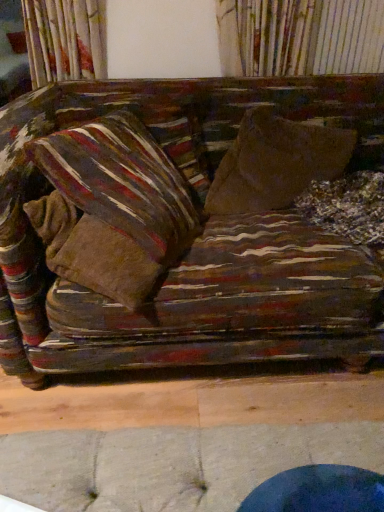
Question: Is striped fabric pillow at upper left, arranged as the first pillow when viewed from the back, situated inside striped fabric pillow at left, the 2th pillow when ordered from back to front, or outside?

Choices:
 (A) outside
 (B) inside

Answer: (A)

Question: From their relative heights in the image, would you say striped fabric pillow at upper left, the 2th pillow positioned from the front, is taller or shorter than striped fabric pillow at left, the 2th pillow when ordered from back to front?

Choices:
 (A) short
 (B) tall

Answer: (A)

Question: Which of these objects is positioned farthest from the striped fabric pillow at left, the 2th pillow when ordered from back to front?

Choices:
 (A) brown fabric throw pillow at center
 (B) striped fabric pillow at upper left, the 2th pillow positioned from the front

Answer: (A)

Question: Which object is positioned farthest from the striped fabric pillow at upper left, the 2th pillow positioned from the front?

Choices:
 (A) striped fabric pillow at left, the 1th pillow viewed from the front
 (B) brown fabric throw pillow at center

Answer: (B)